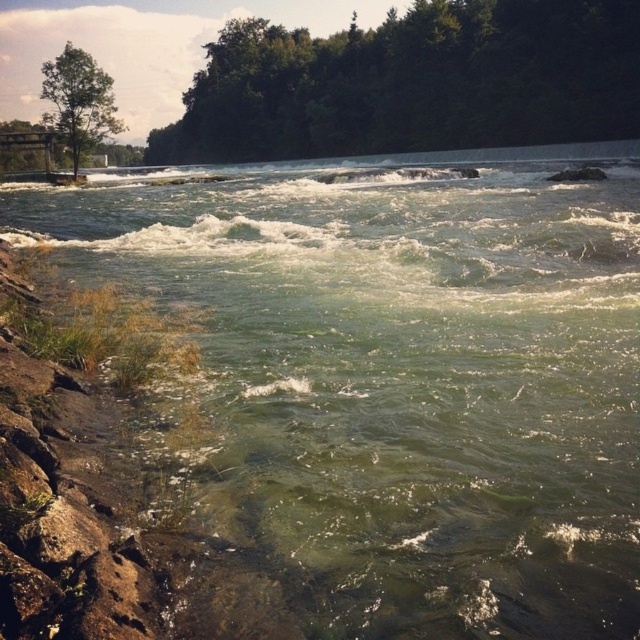
Can you confirm if green leafy tree at upper center is positioned above green matte tree at upper left?

Actually, green leafy tree at upper center is below green matte tree at upper left.

Who is positioned more to the right, green leafy tree at upper center or green matte tree at upper left?

From the viewer's perspective, green leafy tree at upper center appears more on the right side.

Between point (371, 125) and point (80, 65), which one is positioned in front?

Point (80, 65)

The image size is (640, 640). Find the location of `green leafy tree at upper center`. green leafy tree at upper center is located at coordinates (413, 83).